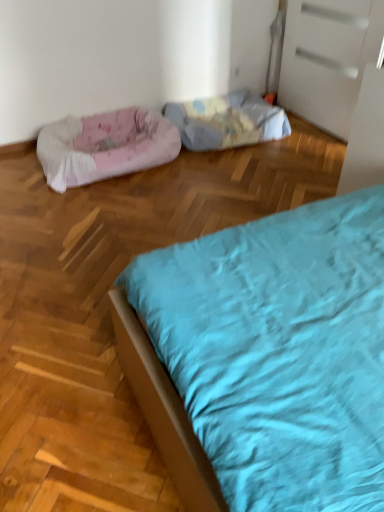
Question: Is fluffy fabric dog bed at center, placed as the first dog bed when sorted from right to left, outside of pink fabric dog bed at left, the 2th dog bed from the right?

Choices:
 (A) yes
 (B) no

Answer: (A)

Question: From the image's perspective, would you say fluffy fabric dog bed at center, which ranks as the 2th dog bed in left-to-right order, is shown under pink fabric dog bed at left, the 2th dog bed from the right?

Choices:
 (A) no
 (B) yes

Answer: (A)

Question: Considering the relative positions of fluffy fabric dog bed at center, placed as the first dog bed when sorted from right to left, and pink fabric dog bed at left, the 2th dog bed from the right, in the image provided, is fluffy fabric dog bed at center, placed as the first dog bed when sorted from right to left, behind pink fabric dog bed at left, the 2th dog bed from the right,?

Choices:
 (A) yes
 (B) no

Answer: (A)

Question: Considering the relative sizes of fluffy fabric dog bed at center, placed as the first dog bed when sorted from right to left, and pink fabric dog bed at left, the 2th dog bed from the right, in the image provided, is fluffy fabric dog bed at center, placed as the first dog bed when sorted from right to left, shorter than pink fabric dog bed at left, the 2th dog bed from the right,?

Choices:
 (A) no
 (B) yes

Answer: (B)

Question: From the image's perspective, is fluffy fabric dog bed at center, which ranks as the 2th dog bed in left-to-right order, over pink fabric dog bed at left, acting as the 1th dog bed starting from the left?

Choices:
 (A) no
 (B) yes

Answer: (B)

Question: Is fluffy fabric dog bed at center, placed as the first dog bed when sorted from right to left, in front of pink fabric dog bed at left, the 2th dog bed from the right?

Choices:
 (A) no
 (B) yes

Answer: (A)

Question: Does pink fabric dog bed at left, acting as the 1th dog bed starting from the left, have a greater width compared to fluffy fabric dog bed at center, placed as the first dog bed when sorted from right to left?

Choices:
 (A) yes
 (B) no

Answer: (A)

Question: Could you tell me if pink fabric dog bed at left, acting as the 1th dog bed starting from the left, is turned towards fluffy fabric dog bed at center, which ranks as the 2th dog bed in left-to-right order?

Choices:
 (A) no
 (B) yes

Answer: (A)

Question: From a real-world perspective, is pink fabric dog bed at left, acting as the 1th dog bed starting from the left, below fluffy fabric dog bed at center, which ranks as the 2th dog bed in left-to-right order?

Choices:
 (A) yes
 (B) no

Answer: (B)

Question: Is pink fabric dog bed at left, the 2th dog bed from the right, shorter than fluffy fabric dog bed at center, which ranks as the 2th dog bed in left-to-right order?

Choices:
 (A) no
 (B) yes

Answer: (A)

Question: Is pink fabric dog bed at left, acting as the 1th dog bed starting from the left, oriented away from fluffy fabric dog bed at center, which ranks as the 2th dog bed in left-to-right order?

Choices:
 (A) yes
 (B) no

Answer: (B)

Question: From a real-world perspective, is pink fabric dog bed at left, acting as the 1th dog bed starting from the left, on top of fluffy fabric dog bed at center, which ranks as the 2th dog bed in left-to-right order?

Choices:
 (A) yes
 (B) no

Answer: (A)

Question: From their relative heights in the image, would you say fluffy fabric dog bed at center, which ranks as the 2th dog bed in left-to-right order, is taller or shorter than pink fabric dog bed at left, acting as the 1th dog bed starting from the left?

Choices:
 (A) tall
 (B) short

Answer: (B)